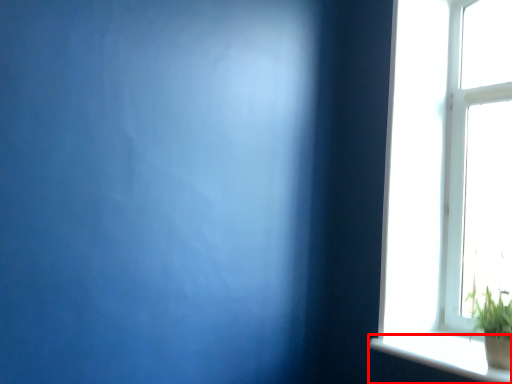
Question: From the image's perspective, where is window sill (annotated by the red box) located relative to houseplant?

Choices:
 (A) above
 (B) below

Answer: (B)